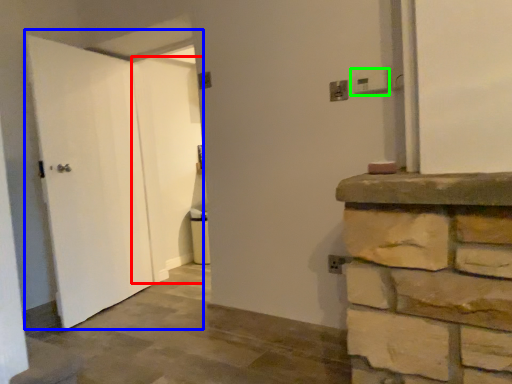
Question: Which object is positioned farthest from door (highlighted by a red box)? Select from door (highlighted by a blue box) and electric outlet (highlighted by a green box).

Choices:
 (A) door
 (B) electric outlet

Answer: (B)